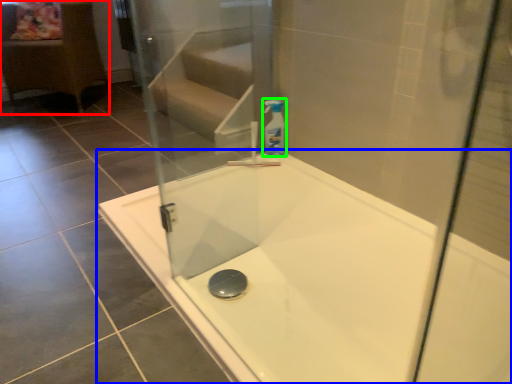
Question: Estimate the real-world distances between objects in this image. Which object is closer to furniture (highlighted by a red box), bathtub (highlighted by a blue box) or cleaning product (highlighted by a green box)?

Choices:
 (A) bathtub
 (B) cleaning product

Answer: (B)